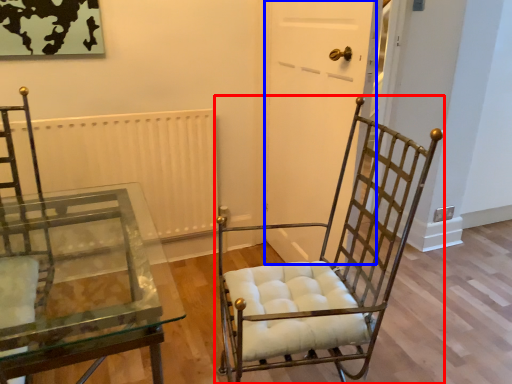
Question: Among these objects, which one is farthest to the camera, chair (highlighted by a red box) or glass door (highlighted by a blue box)?

Choices:
 (A) chair
 (B) glass door

Answer: (B)